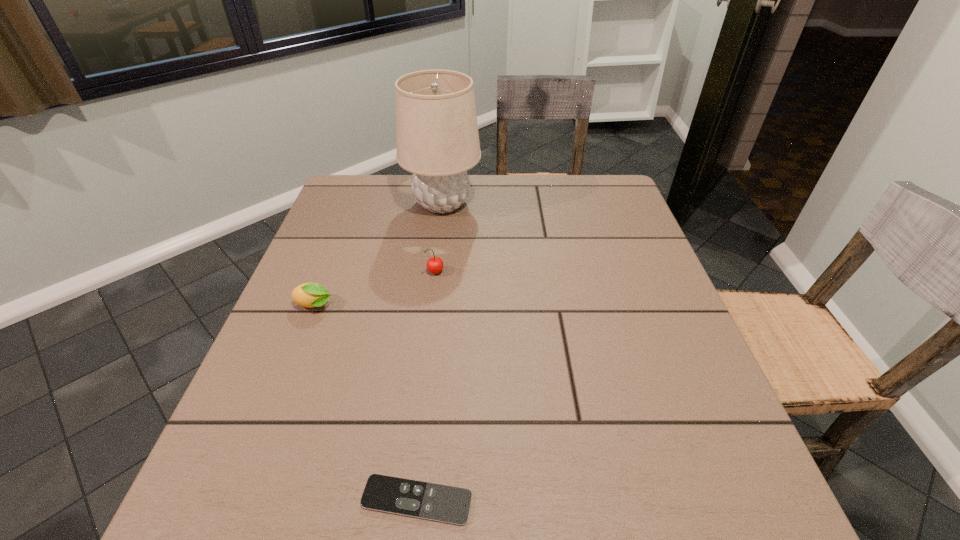
The width and height of the screenshot is (960, 540). In order to click on lampshade in this screenshot , I will do `click(437, 139)`.

Identify the location of the farthest object. Image resolution: width=960 pixels, height=540 pixels. (437, 139).

Locate an element on the screen. Image resolution: width=960 pixels, height=540 pixels. cherry is located at coordinates (435, 264).

This screenshot has width=960, height=540. Find the location of `the third shortest object`. the third shortest object is located at coordinates pos(435,264).

Find the location of a particular element. The width and height of the screenshot is (960, 540). the second nearest object is located at coordinates (310, 295).

Locate an element on the screen. This screenshot has width=960, height=540. lemon is located at coordinates (310, 295).

Where is `the nearest object`? the nearest object is located at coordinates (442, 503).

Find the location of a particular element. This screenshot has height=540, width=960. remote control is located at coordinates (442, 503).

Locate an element on the screen. The height and width of the screenshot is (540, 960). free region located 0.080m on the front of the lampshade is located at coordinates (437, 245).

Locate an element on the screen. This screenshot has height=540, width=960. free location located 0.070m on the back of the second tallest object is located at coordinates tap(439, 248).